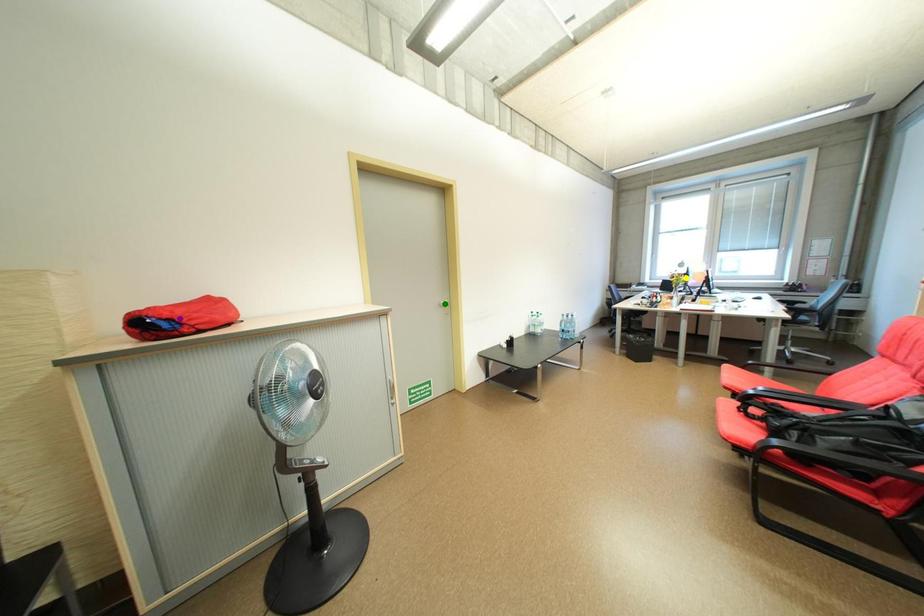
Order these from nearest to farthest:
purple point | green point | yellow point

purple point
green point
yellow point